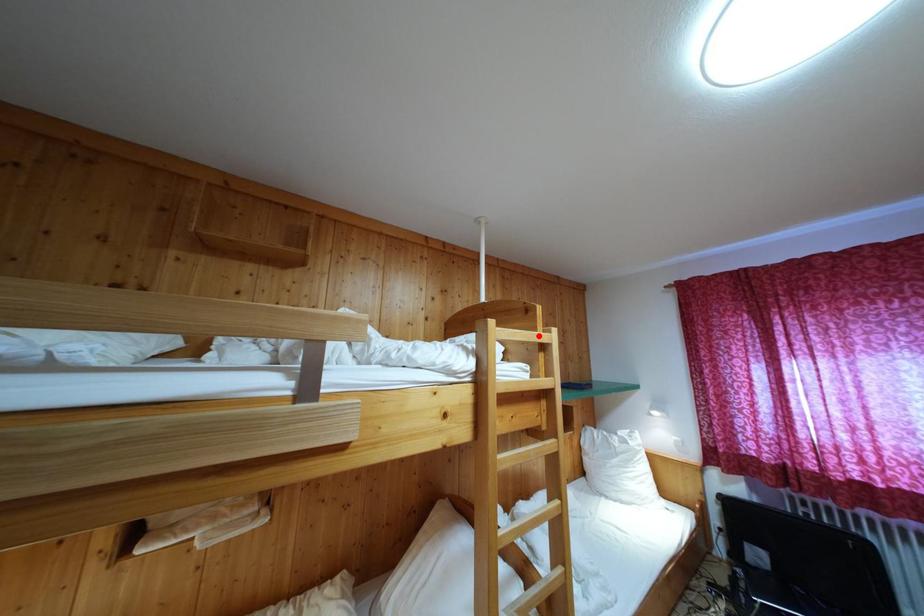
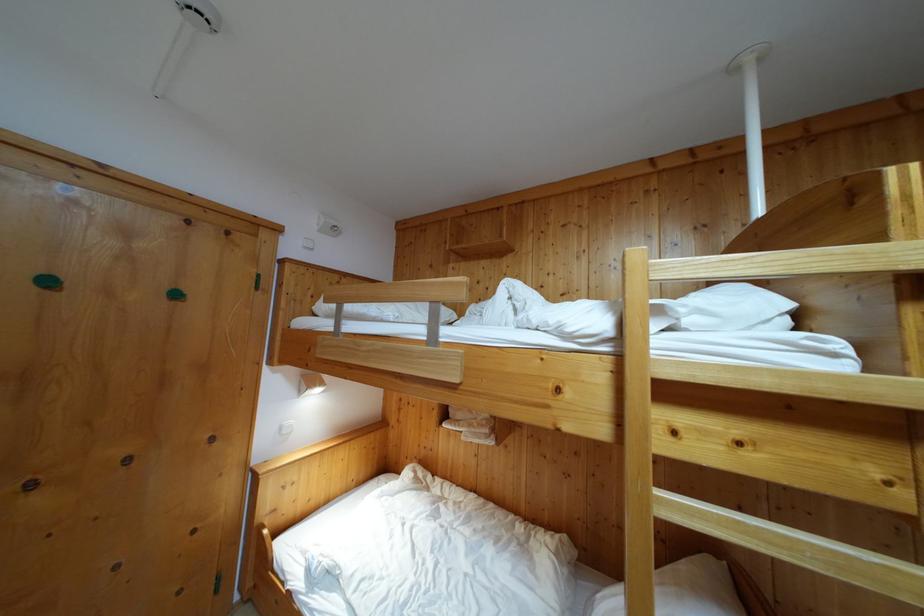
Question: I am providing you with two images of the same scene from different viewpoints. In image1, a red point is highlighted. Considering the same 3D point in image2, which of the following is correct?

Choices:
 (A) It is closer
 (B) It is farther

Answer: (B)